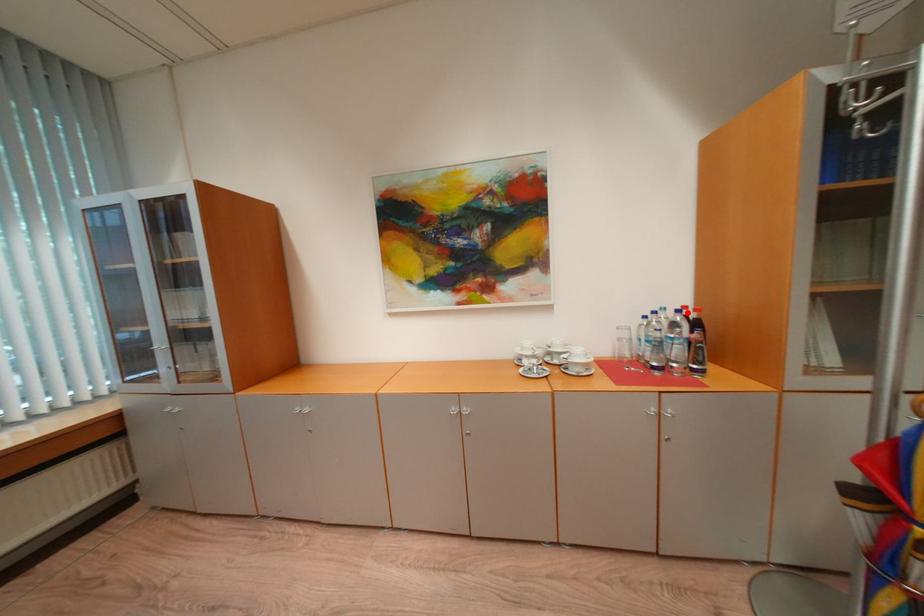
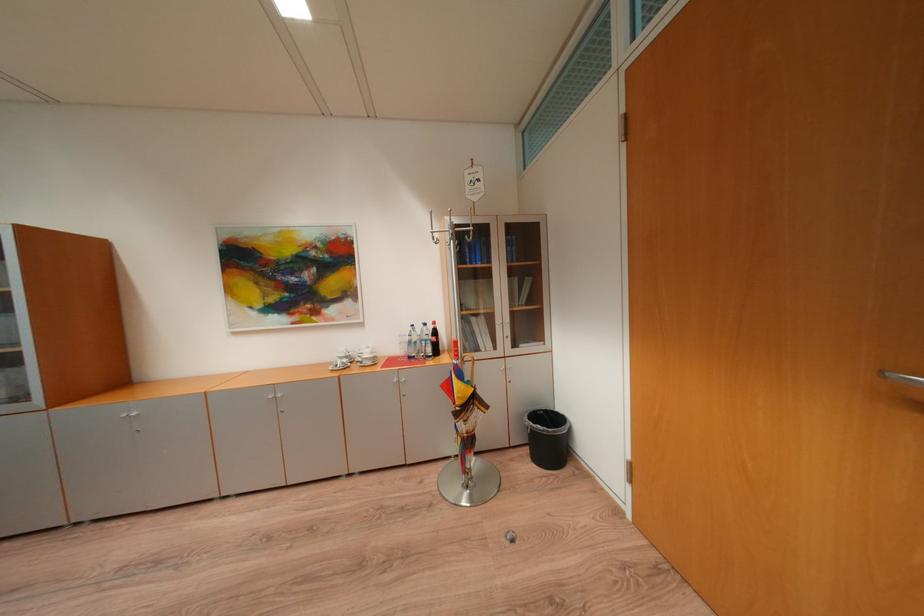
The point at the highlighted location is marked in the first image. Where is the corresponding point in the second image?

(434, 326)